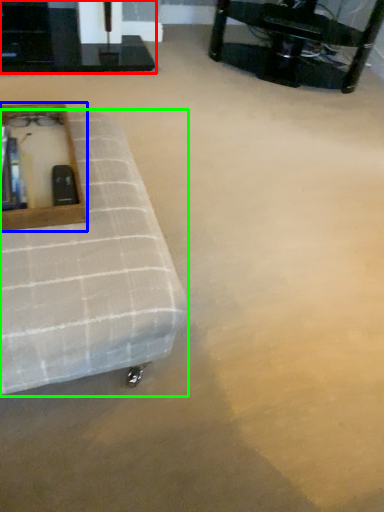
Question: Which object is positioned closest to table (highlighted by a red box)? Select from vanity (highlighted by a blue box) and furniture (highlighted by a green box).

Choices:
 (A) vanity
 (B) furniture

Answer: (A)